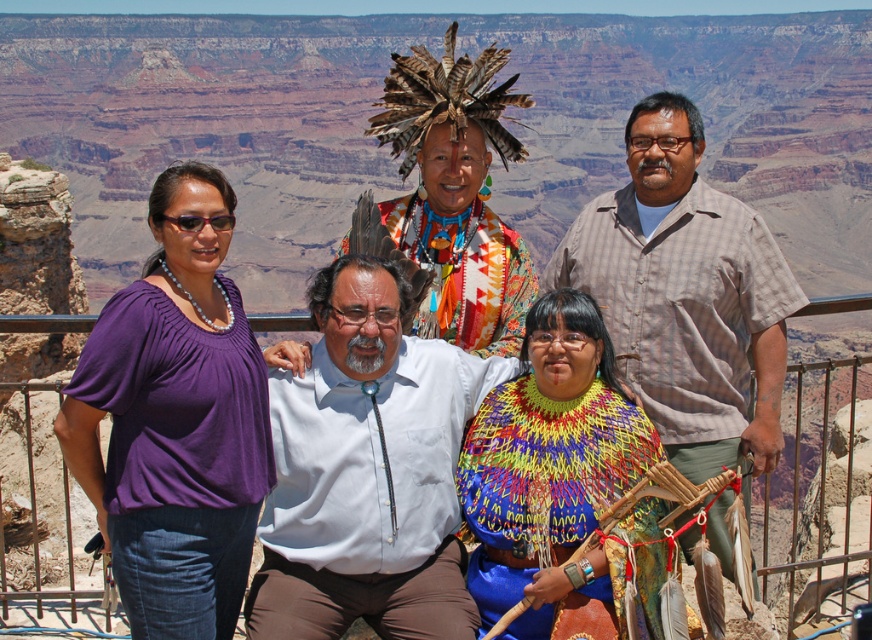
Question: Is the position of white cotton shirt at center less distant than that of multicolored woven shawl at center?

Choices:
 (A) yes
 (B) no

Answer: (A)

Question: Does purple fabric shirt at left appear over multicolored woven shawl at center?

Choices:
 (A) yes
 (B) no

Answer: (A)

Question: Which of these objects is positioned farthest from the purple fabric shirt at left?

Choices:
 (A) multicolored woven shawl at center
 (B) plaid shirt at center

Answer: (B)

Question: Which point is closer to the camera taking this photo?

Choices:
 (A) (738, 266)
 (B) (543, 541)

Answer: (B)

Question: Which object appears closest to the camera in this image?

Choices:
 (A) multicolored woven shawl at center
 (B) white cotton shirt at center

Answer: (B)

Question: Is purple fabric shirt at left thinner than multicolored woven shawl at center?

Choices:
 (A) yes
 (B) no

Answer: (B)